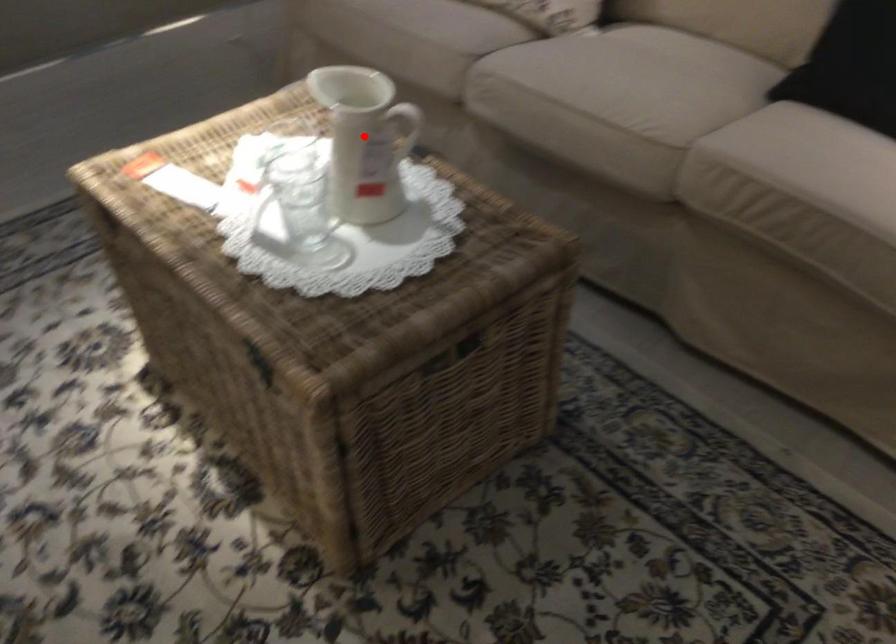
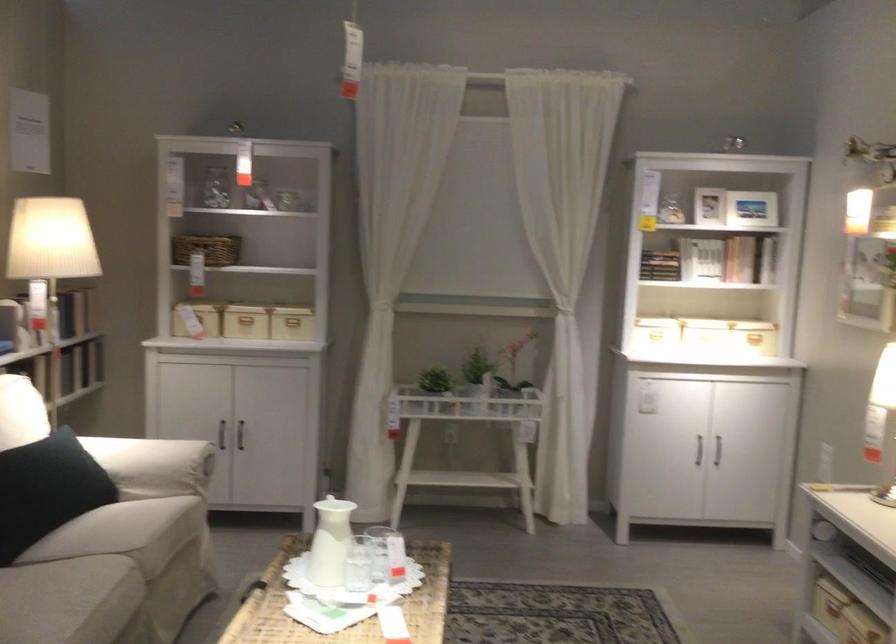
In the second image, find the point that corresponds to the highlighted location in the first image.

(330, 542)